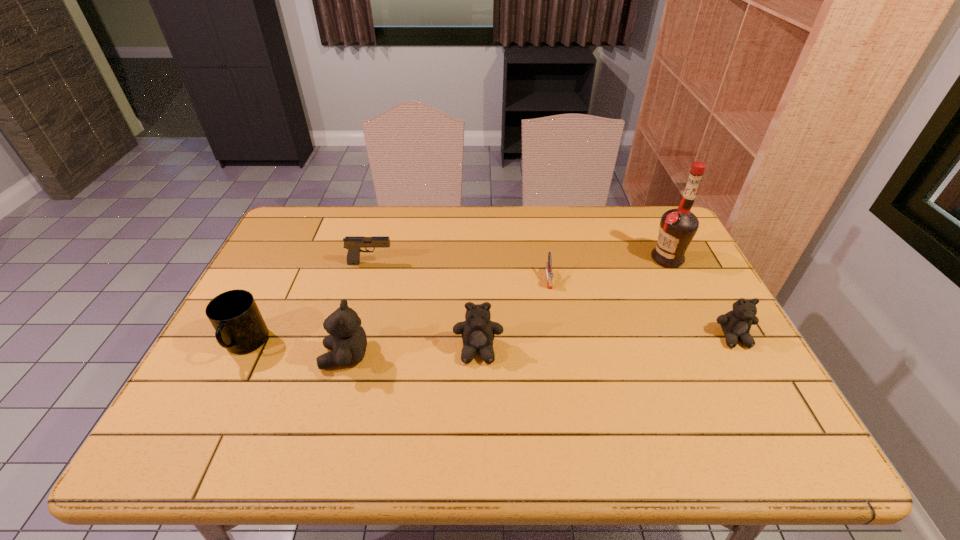
The image size is (960, 540). In order to click on vacant spot for a new teddy_bear to ensure equal spacing in this screenshot , I will do `click(608, 344)`.